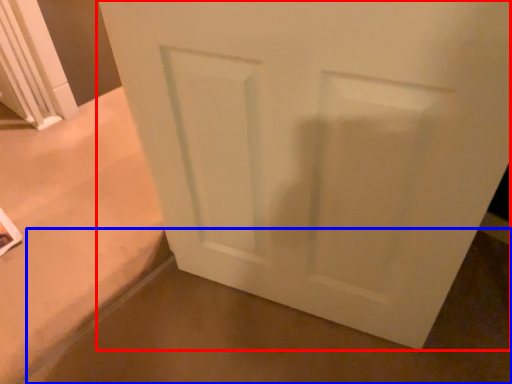
Question: Which object appears farthest to the camera in this image, door (highlighted by a red box) or concrete (highlighted by a blue box)?

Choices:
 (A) door
 (B) concrete

Answer: (B)